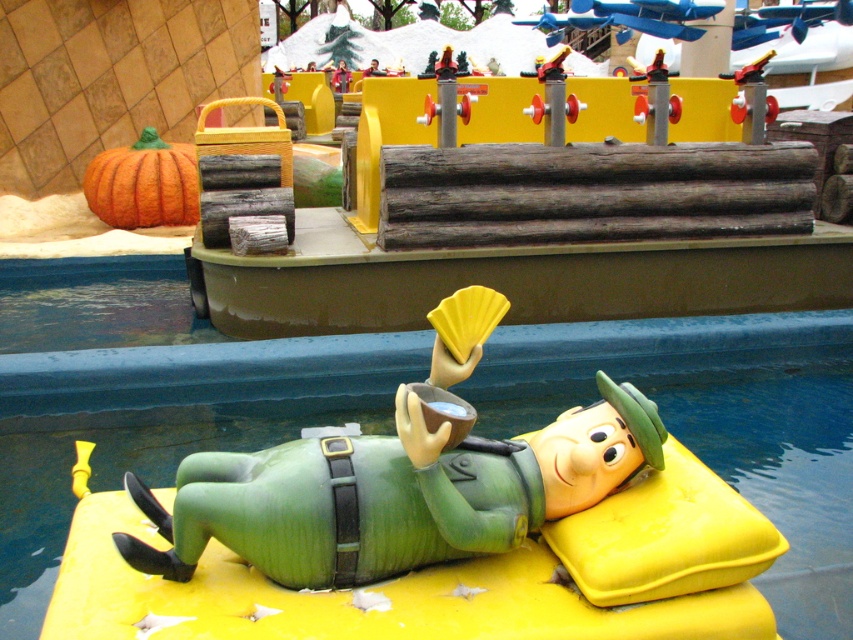
You are navigating a boat in the amusement park and see two points marked on your map. The first point is at coordinate point (45, 323) and the second is at point (349, 536). According to the scene description, which point is closer to the front of the image?

Point (349, 536) is closer to the front of the image because it is in front of point (45, 323) as stated in the objects description.

You are a visitor at this amusement park and want to take a photo of the smooth green figure at center and the orange matte pumpkin at upper left. Which object should you focus on first if you want to capture both in the same frame without moving the camera?

You should focus on the smooth green figure at center first because it is closer to you than the orange matte pumpkin at upper left, allowing both to be in the frame without moving the camera.